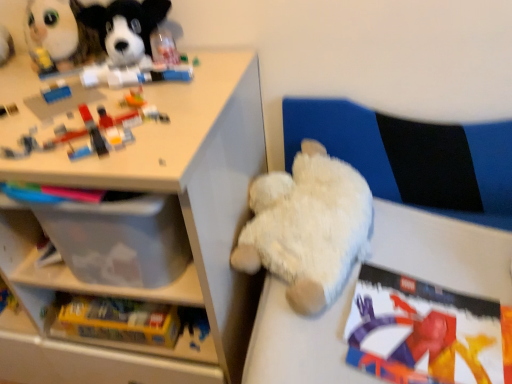
Question: Is fluffy white plush at upper left, which is the 4th toy in right-to-left order, shorter than white fluffy teddy bear at center, which is counted as the 1th toy, starting from the right?

Choices:
 (A) no
 (B) yes

Answer: (B)

Question: From the image's perspective, is fluffy white plush at upper left, which is the 4th toy in right-to-left order, located above white fluffy teddy bear at center, marked as the 4th toy in a left-to-right arrangement?

Choices:
 (A) yes
 (B) no

Answer: (A)

Question: Is the position of fluffy white plush at upper left, which is the 4th toy in right-to-left order, more distant than that of white fluffy teddy bear at center, which is counted as the 1th toy, starting from the right?

Choices:
 (A) no
 (B) yes

Answer: (B)

Question: Can you confirm if fluffy white plush at upper left, the first toy viewed from the left, is positioned to the left of white fluffy teddy bear at center, marked as the 4th toy in a left-to-right arrangement?

Choices:
 (A) yes
 (B) no

Answer: (A)

Question: Is fluffy white plush at upper left, the first toy viewed from the left, beside white fluffy teddy bear at center, which is counted as the 1th toy, starting from the right?

Choices:
 (A) yes
 (B) no

Answer: (B)

Question: From a real-world perspective, is fluffy white plush at upper left, the first toy viewed from the left, beneath white fluffy teddy bear at center, marked as the 4th toy in a left-to-right arrangement?

Choices:
 (A) no
 (B) yes

Answer: (A)

Question: Is white fluffy teddy bear at center, marked as the 4th toy in a left-to-right arrangement, directly adjacent to matte plastic book at lower right?

Choices:
 (A) yes
 (B) no

Answer: (B)

Question: Is white fluffy teddy bear at center, which is counted as the 1th toy, starting from the right, completely or partially outside of matte plastic book at lower right?

Choices:
 (A) yes
 (B) no

Answer: (A)

Question: Does white fluffy teddy bear at center, which is counted as the 1th toy, starting from the right, appear on the right side of matte plastic book at lower right?

Choices:
 (A) yes
 (B) no

Answer: (B)

Question: From the image's perspective, is white fluffy teddy bear at center, marked as the 4th toy in a left-to-right arrangement, over matte plastic book at lower right?

Choices:
 (A) no
 (B) yes

Answer: (B)

Question: Is white fluffy teddy bear at center, marked as the 4th toy in a left-to-right arrangement, further to camera compared to matte plastic book at lower right?

Choices:
 (A) no
 (B) yes

Answer: (B)

Question: Considering the relative sizes of white fluffy teddy bear at center, which is counted as the 1th toy, starting from the right, and matte plastic book at lower right in the image provided, is white fluffy teddy bear at center, which is counted as the 1th toy, starting from the right, wider than matte plastic book at lower right?

Choices:
 (A) no
 (B) yes

Answer: (B)

Question: Can you confirm if fluffy white plush at upper left, which is the 4th toy in right-to-left order, is bigger than matte plastic book at lower right?

Choices:
 (A) no
 (B) yes

Answer: (A)